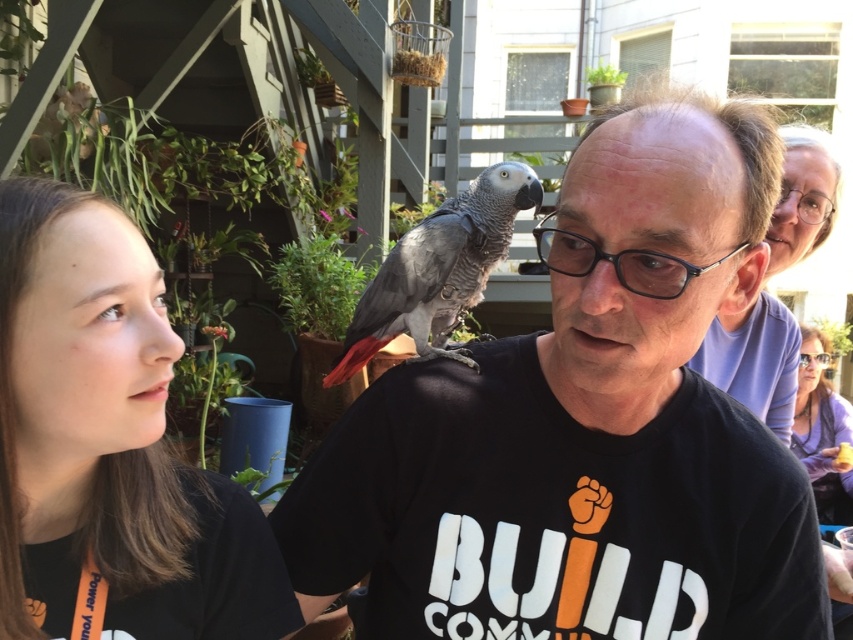
Question: Does gray matte parrot at center appear over black plastic glasses at upper right?

Choices:
 (A) no
 (B) yes

Answer: (A)

Question: Which point is farther from the camera taking this photo?

Choices:
 (A) (364, 304)
 (B) (817, 216)

Answer: (B)

Question: Which point appears closest to the camera in this image?

Choices:
 (A) (627, 289)
 (B) (373, 346)

Answer: (A)

Question: Estimate the real-world distances between objects in this image. Which object is closer to the brown matte hair at upper left?

Choices:
 (A) matte purple shirt at upper right
 (B) transparent plastic glasses at upper center

Answer: (A)

Question: Can you confirm if black plastic glasses at center is smaller than transparent plastic glasses at upper center?

Choices:
 (A) no
 (B) yes

Answer: (A)

Question: Does black plastic glasses at center have a lesser width compared to transparent plastic glasses at upper center?

Choices:
 (A) yes
 (B) no

Answer: (A)